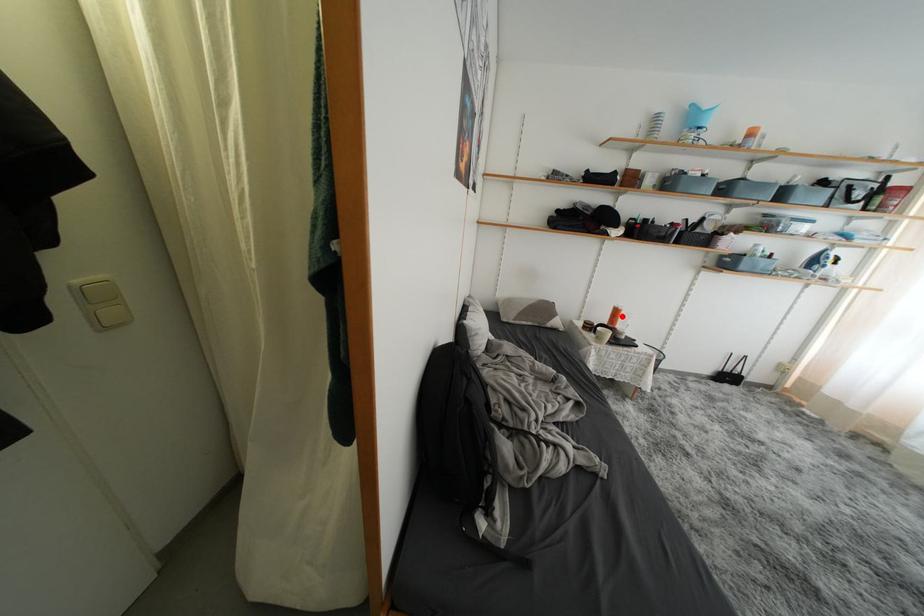
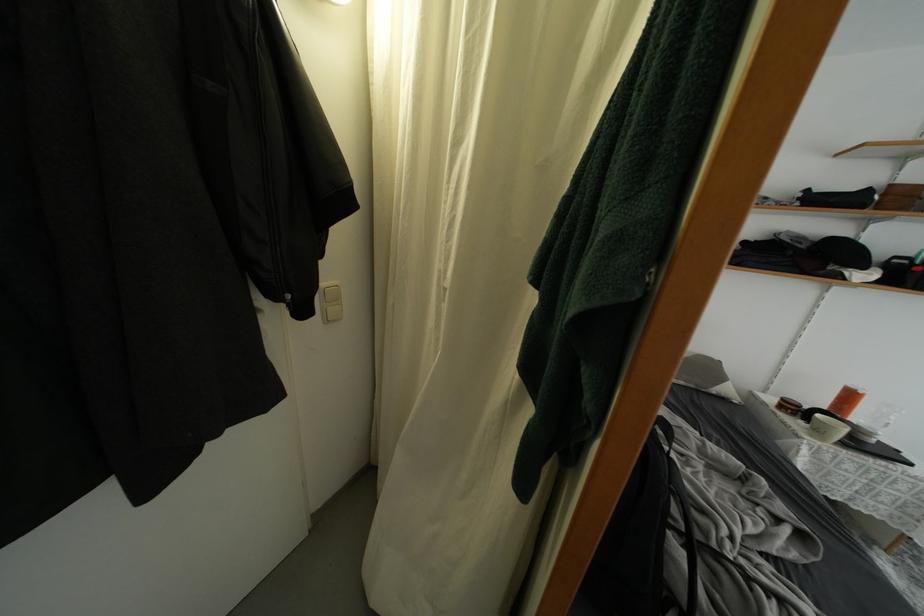
In the second image, find the point that corresponds to the highlighted location in the first image.

(856, 400)